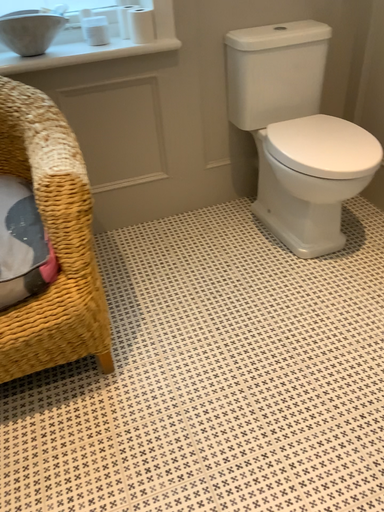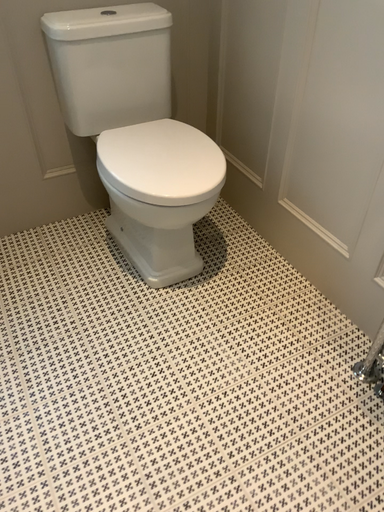
Question: How did the camera likely rotate when shooting the video?

Choices:
 (A) rotated left
 (B) rotated right

Answer: (B)